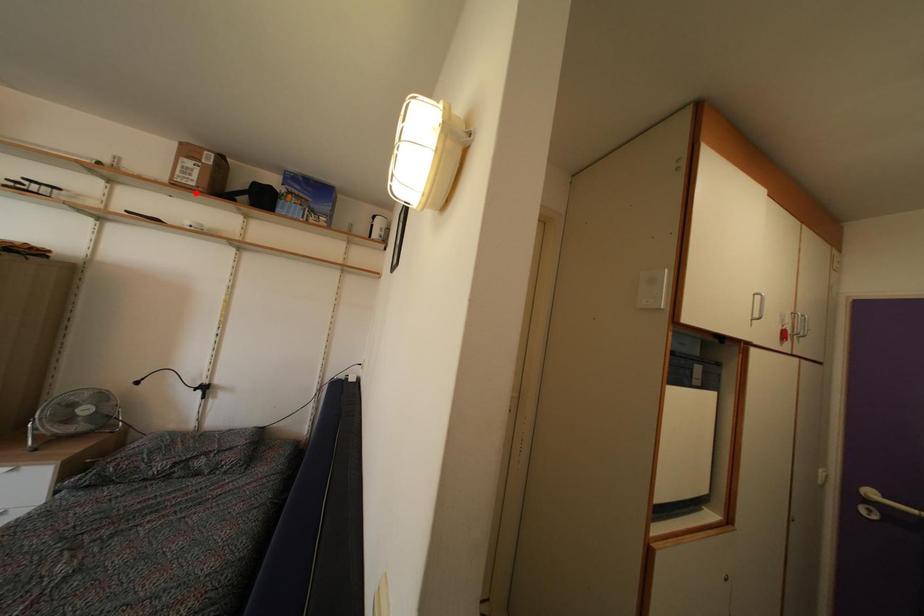
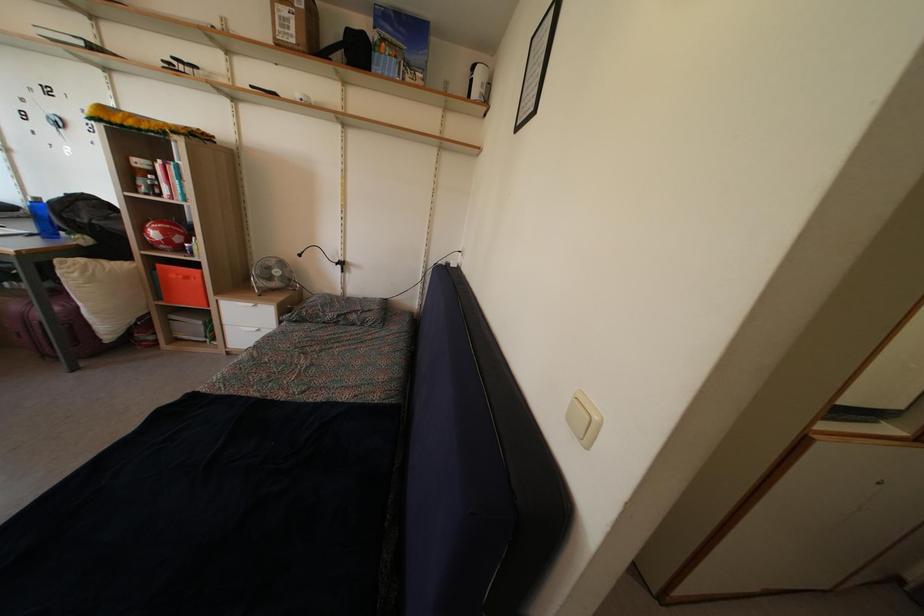
Locate, in the second image, the point that corresponds to the highlighted location in the first image.

(296, 50)